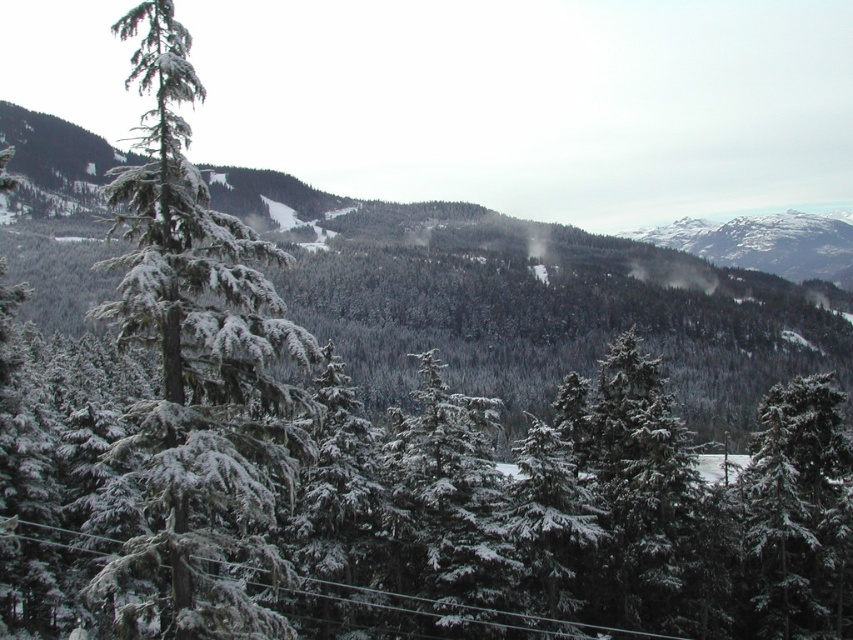
Question: Which is farther from the snow-covered evergreen at right?

Choices:
 (A) snow-covered evergreen trees at center
 (B) snow-covered evergreen at center

Answer: (A)

Question: Does snow-covered evergreen trees at center appear under snow-covered evergreen at center?

Choices:
 (A) no
 (B) yes

Answer: (A)

Question: Is snow-covered evergreen trees at center to the left of snow-covered evergreen at center from the viewer's perspective?

Choices:
 (A) yes
 (B) no

Answer: (A)

Question: Which point is farther to the camera?

Choices:
 (A) (25, 262)
 (B) (126, 177)

Answer: (A)

Question: Among these points, which one is farthest from the camera?

Choices:
 (A) (167, 595)
 (B) (793, 568)

Answer: (B)

Question: Can you confirm if snow-covered evergreen trees at center is positioned above snow-covered evergreen at center?

Choices:
 (A) yes
 (B) no

Answer: (A)